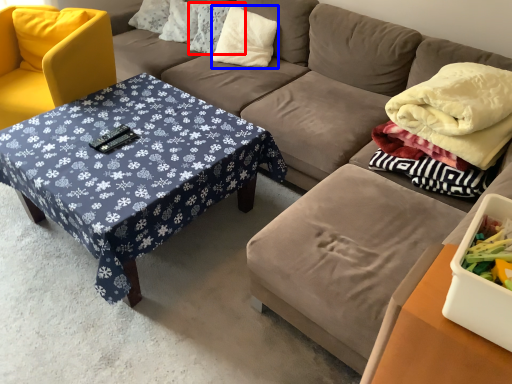
Question: Which of the following is the farthest to the observer, pillow (highlighted by a red box) or pillow (highlighted by a blue box)?

Choices:
 (A) pillow
 (B) pillow

Answer: (A)